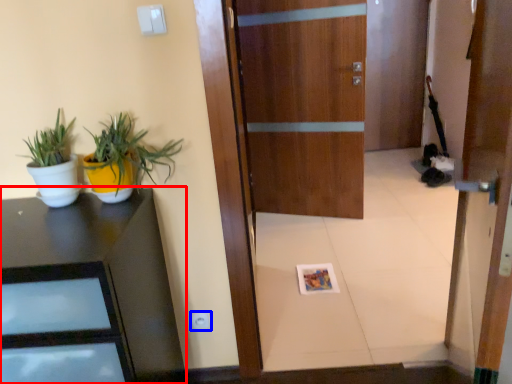
Question: Which object is closer to the camera taking this photo, desk (highlighted by a red box) or electric outlet (highlighted by a blue box)?

Choices:
 (A) desk
 (B) electric outlet

Answer: (A)